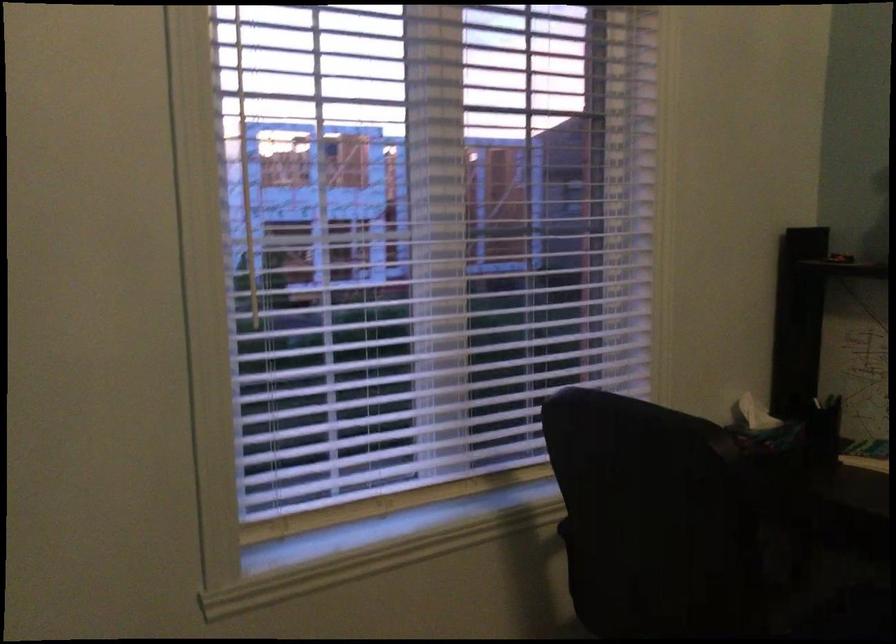
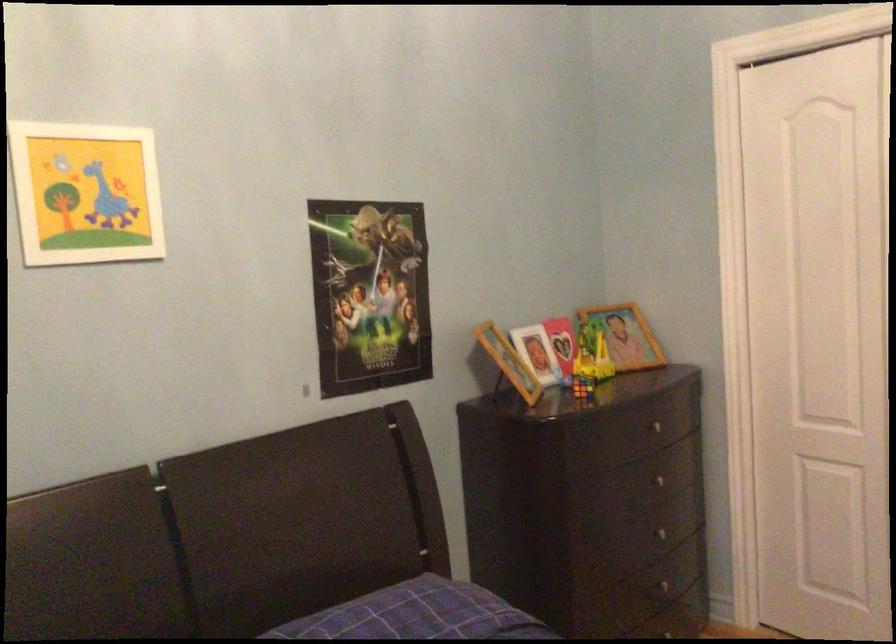
Question: The camera is either moving clockwise (left) or counter-clockwise (right) around the object. The first image is from the beginning of the video and the second image is from the end. Is the camera moving left or right when shooting the video?

Choices:
 (A) Left
 (B) Right

Answer: (A)